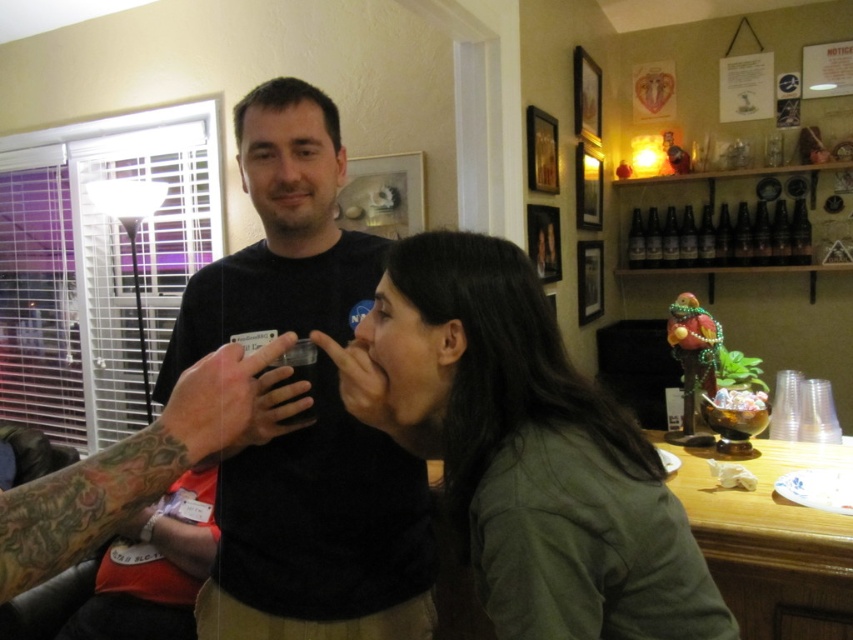
Does green matte shirt at center have a lesser height compared to black matte shirt at upper center?

Indeed, green matte shirt at center has a lesser height compared to black matte shirt at upper center.

In order to click on green matte shirt at center in this screenshot , I will do `click(525, 449)`.

This screenshot has height=640, width=853. I want to click on green matte shirt at center, so click(525, 449).

In the scene shown: Who is shorter, green matte shirt at center or translucent plastic cup at left?

translucent plastic cup at left

Can you confirm if green matte shirt at center is wider than translucent plastic cup at left?

Indeed, green matte shirt at center has a greater width compared to translucent plastic cup at left.

Which is in front, point (521, 317) or point (213, 376)?

Positioned in front is point (213, 376).

At what (x,y) coordinates should I click in order to perform the action: click on green matte shirt at center. Please return your answer as a coordinate pair (x, y). This screenshot has width=853, height=640. Looking at the image, I should click on (525, 449).

Can you confirm if black matte shirt at upper center is positioned to the right of translucent plastic cup at left?

No, black matte shirt at upper center is not to the right of translucent plastic cup at left.

Locate an element on the screen. This screenshot has width=853, height=640. black matte shirt at upper center is located at coordinates (317, 524).

Locate an element on the screen. black matte shirt at upper center is located at coordinates (317, 524).